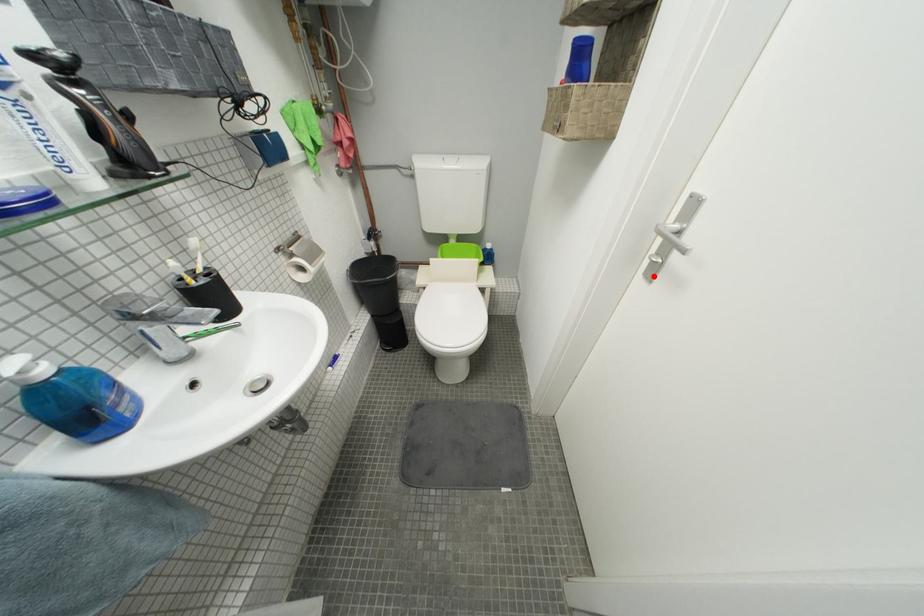
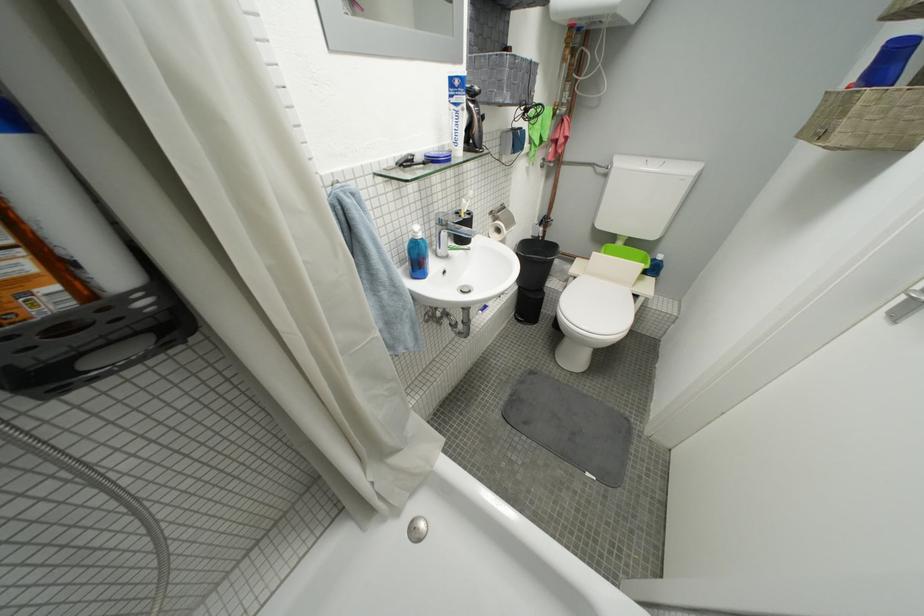
Find the pixel in the second image that matches the highlighted location in the first image.

(900, 315)